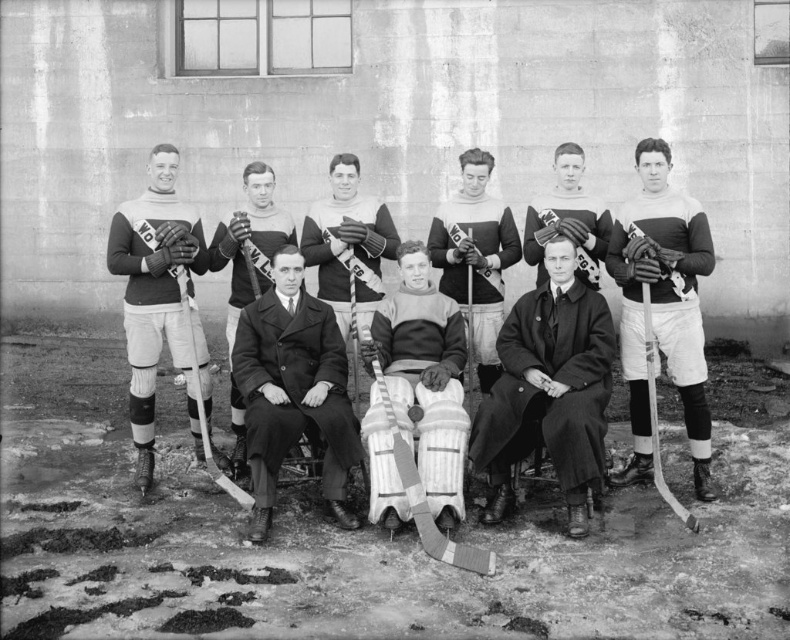
Question: Does smooth black coat at center appear on the right side of striped jersey at center?

Choices:
 (A) yes
 (B) no

Answer: (A)

Question: Which of the following is the farthest from the observer?

Choices:
 (A) wooden hockey stick at center
 (B) smooth black suit at center
 (C) white cotton jersey at right

Answer: (C)

Question: Which point appears farthest from the camera in this image?

Choices:
 (A) (186, 307)
 (B) (243, 301)
 (C) (286, 426)

Answer: (B)

Question: Does dark brown leather gloves at upper center appear under matte black hockey stick at center?

Choices:
 (A) no
 (B) yes

Answer: (A)

Question: Among these objects, which one is nearest to the camera?

Choices:
 (A) dark brown leather gloves at upper center
 (B) matte black hockey stick at center
 (C) matte black hockey uniform at left
 (D) white cotton jersey at right

Answer: (D)

Question: Is matte black hockey uniform at left thinner than striped jersey at center?

Choices:
 (A) no
 (B) yes

Answer: (A)